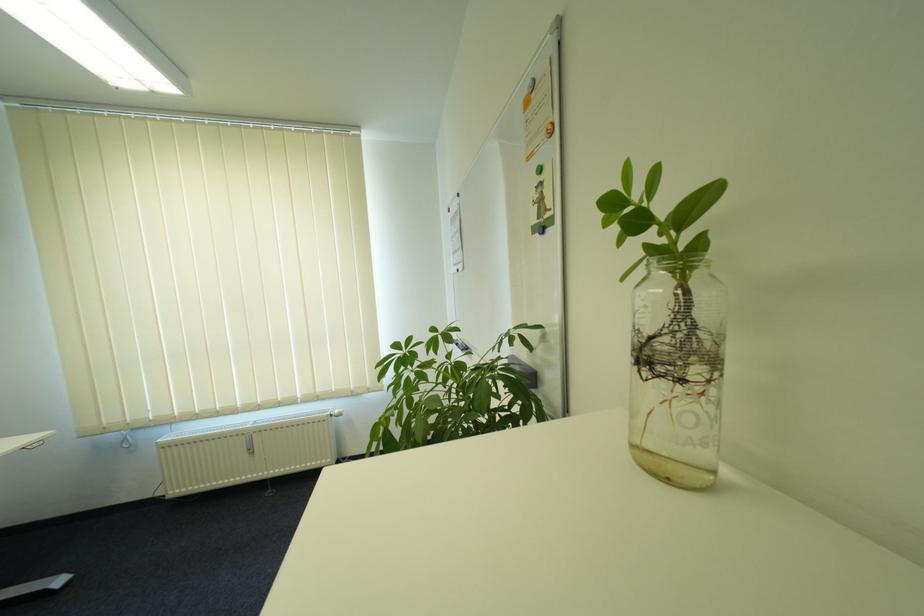
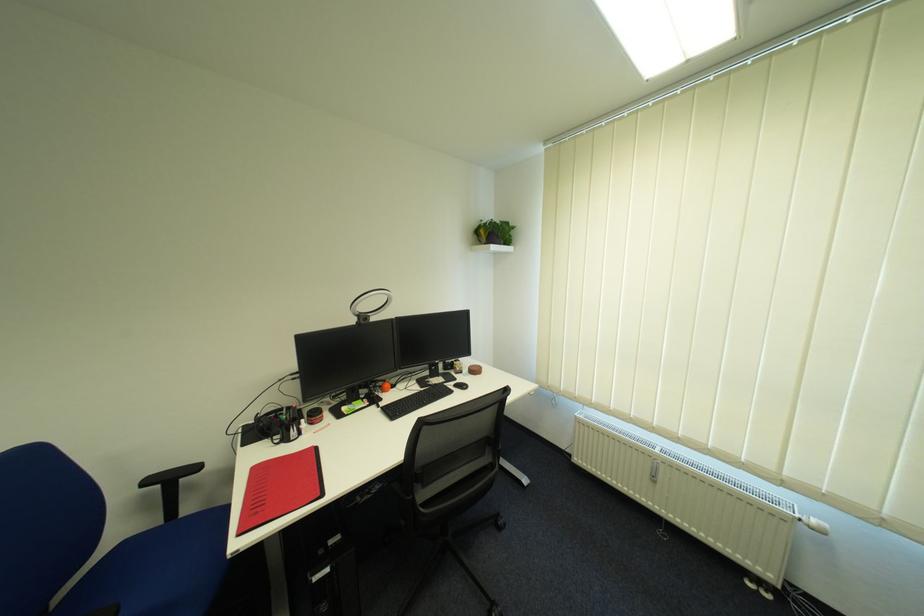
The point at [262,454] is marked in the first image. Where is the corresponding point in the second image?

(664, 483)